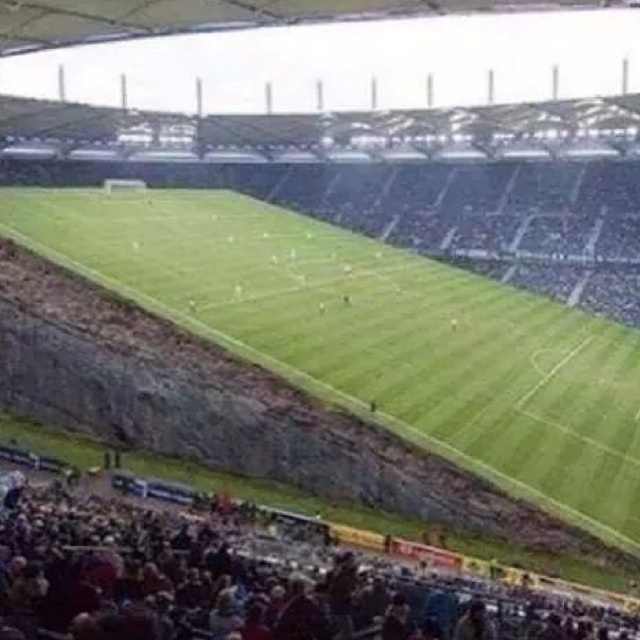
Question: Does green grass football field at center appear under dark brown leather seats at lower left?

Choices:
 (A) yes
 (B) no

Answer: (B)

Question: Which object is farther from the camera taking this photo?

Choices:
 (A) green grass football field at center
 (B) dark brown leather seats at lower left

Answer: (A)

Question: Which point appears closest to the camera in this image?

Choices:
 (A) (90, 189)
 (B) (170, 508)

Answer: (B)

Question: Does green grass football field at center have a smaller size compared to dark brown leather seats at lower left?

Choices:
 (A) no
 (B) yes

Answer: (A)

Question: Is green grass football field at center to the left of dark brown leather seats at lower left from the viewer's perspective?

Choices:
 (A) yes
 (B) no

Answer: (B)